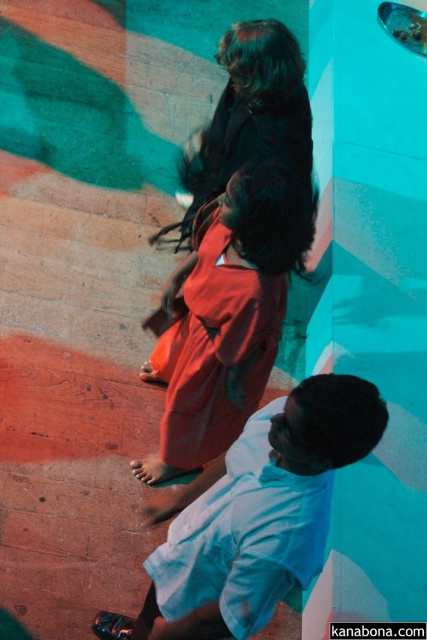
You are a delivery person who needs to deliver a package to the person wearing the white cotton shirt at lower center. The package is 1.5 meters long. Can you hand over the package without needing to move closer than 1.5 meters?

The distance between you and the white cotton shirt at lower center is 1.56 meters, so yes, you can hand over the package without needing to move closer since the distance is slightly more than the package length.

You are standing in the urban setting shown in the image. You see the white cotton shirt at lower center and the matte red dress at center. Which object is nearer to you?

The white cotton shirt at lower center is closer to the viewer than the matte red dress at center.